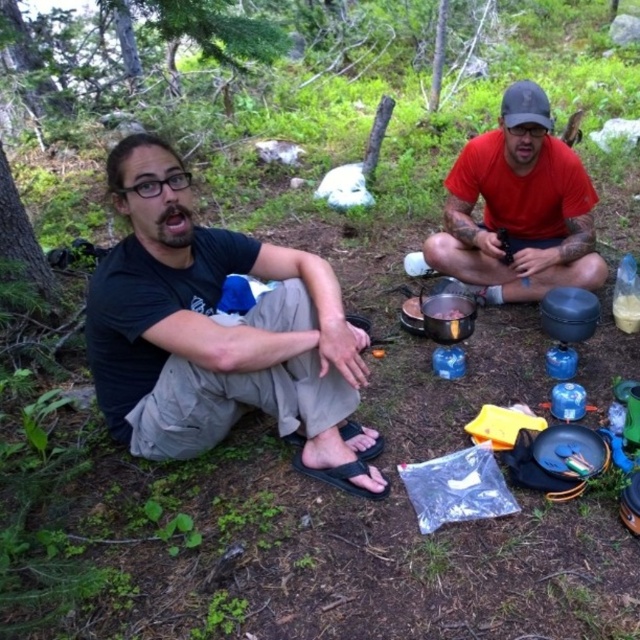
Based on the scene description, where is the black matte shirt at left located in the image?

The black matte shirt at left is located at point 0.520 on the x axis and 0.341 on the y axis.